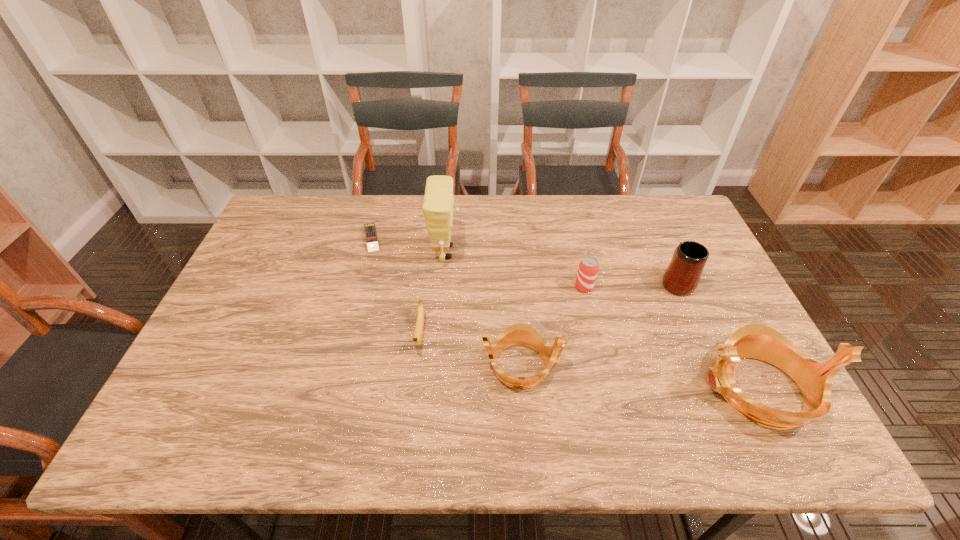
Find the location of `empty space that is in between the fifth shortest object and the sponge`. empty space that is in between the fifth shortest object and the sponge is located at coordinates (561, 267).

You are a GUI agent. You are given a task and a screenshot of the screen. Output one action in this format:
    pyautogui.click(x=<x>, y=<y>)
    Task: Click on the vacant space that is in between the fifth object from left to right and the sixth tallest object
    Image resolution: width=960 pixels, height=540 pixels.
    Given the screenshot: What is the action you would take?
    [502, 310]

Identify which object is the second closest to the fourth object from right to left. Please provide its 2D coordinates. Your answer should be formatted as a tuple, i.e. [(x, y)], where the tuple contains the x and y coordinates of a point satisfying the conditions above.

[(588, 268)]

Locate an element on the screen. The width and height of the screenshot is (960, 540). object that stands as the closest to the shorter tiara is located at coordinates (418, 334).